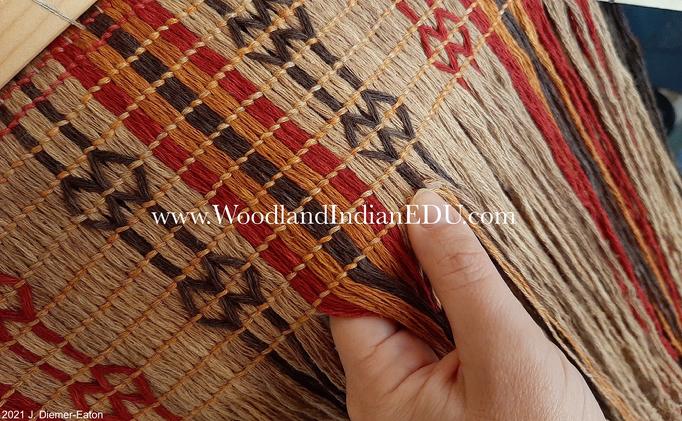
This screenshot has width=682, height=421. I want to click on knitted blanket, so click(329, 160).